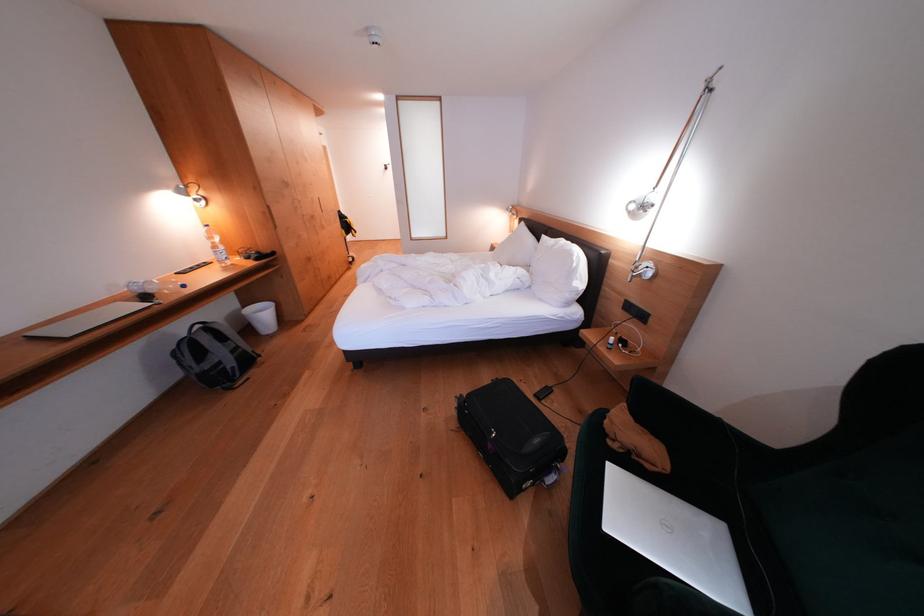
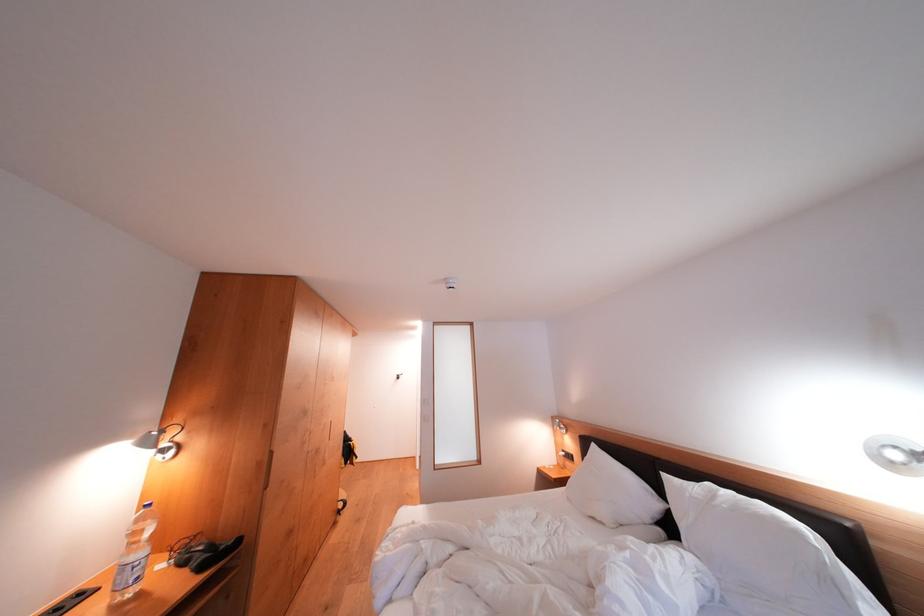
The point at (203, 205) is marked in the first image. Where is the corresponding point in the second image?

(169, 455)